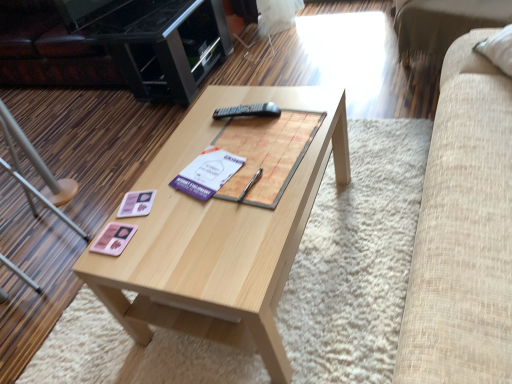
Find the location of a particular element. unoccupied region to the right of black plastic remote at center is located at coordinates (288, 107).